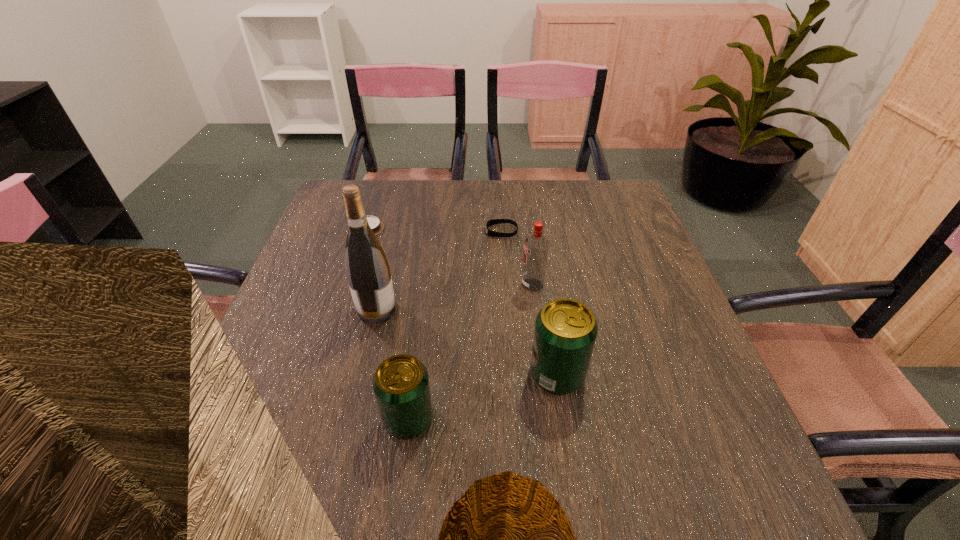
I want to click on the left beer can, so click(x=401, y=385).

The height and width of the screenshot is (540, 960). Find the location of `the third object from left to right`. the third object from left to right is located at coordinates (401, 385).

At what (x,y) coordinates should I click in order to perform the action: click on the right beer can. Please return your answer as a coordinate pair (x, y). The image size is (960, 540). Looking at the image, I should click on (565, 332).

The width and height of the screenshot is (960, 540). Identify the location of chocolate cake. (376, 225).

At what (x,y) coordinates should I click in order to perform the action: click on the tallest object. Please return your answer as a coordinate pair (x, y). This screenshot has height=540, width=960. Looking at the image, I should click on (367, 268).

Identify the location of wine bottle. (367, 268).

This screenshot has height=540, width=960. Identify the location of vodka. (536, 247).

Identify the location of wristband. The height and width of the screenshot is (540, 960). (494, 221).

Locate an element on the screen. vacant space located 0.100m on the back of the third shortest object is located at coordinates (417, 355).

At what (x,y) coordinates should I click in order to perform the action: click on blank space located on the back of the right beer can. Please return your answer as a coordinate pair (x, y). This screenshot has height=540, width=960. Looking at the image, I should click on (548, 317).